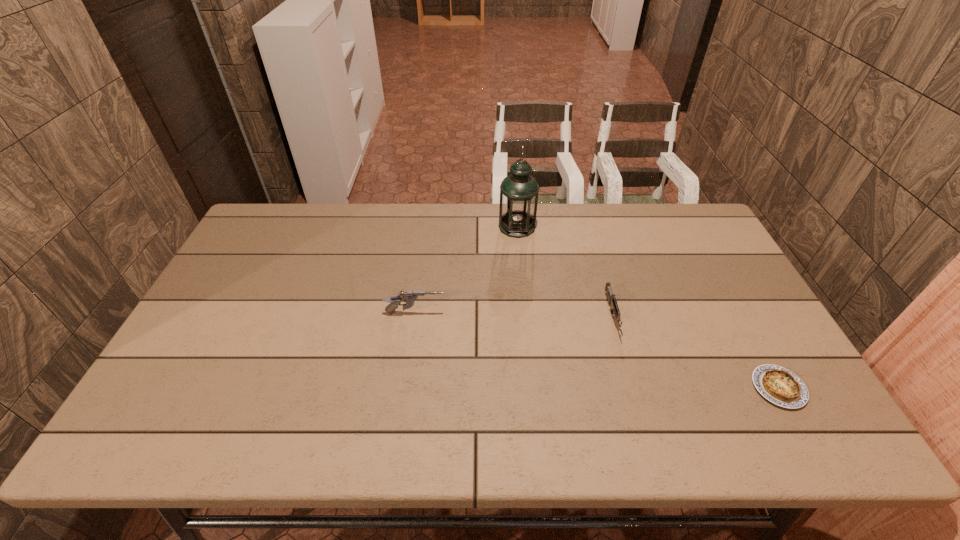
At what (x,y) coordinates should I click in order to perform the action: click on free point between the second tallest object and the shorter gun. Please return your answer as a coordinate pair (x, y). The width and height of the screenshot is (960, 540). Looking at the image, I should click on (514, 315).

This screenshot has height=540, width=960. I want to click on unoccupied area between the shortest object and the right gun, so click(695, 352).

Image resolution: width=960 pixels, height=540 pixels. I want to click on vacant area that lies between the rightmost object and the leftmost object, so pyautogui.click(x=597, y=350).

Image resolution: width=960 pixels, height=540 pixels. I want to click on empty location between the tallest object and the second tallest object, so pyautogui.click(x=467, y=270).

Identify the location of unoccupied area between the tallest object and the right gun. (564, 272).

The height and width of the screenshot is (540, 960). I want to click on vacant area between the leftmost object and the rightmost object, so click(x=597, y=350).

The width and height of the screenshot is (960, 540). Find the location of `vacant point located between the shortest object and the shorter gun`. vacant point located between the shortest object and the shorter gun is located at coordinates (695, 352).

Locate an element on the screen. empty space between the shorter gun and the farthest object is located at coordinates (564, 272).

At what (x,y) coordinates should I click in order to perform the action: click on unoccupied position between the rightmost object and the right gun. Please return your answer as a coordinate pair (x, y). The image size is (960, 540). Looking at the image, I should click on [695, 352].

The image size is (960, 540). In order to click on blank region between the quiche and the oil lamp in this screenshot , I will do `click(648, 307)`.